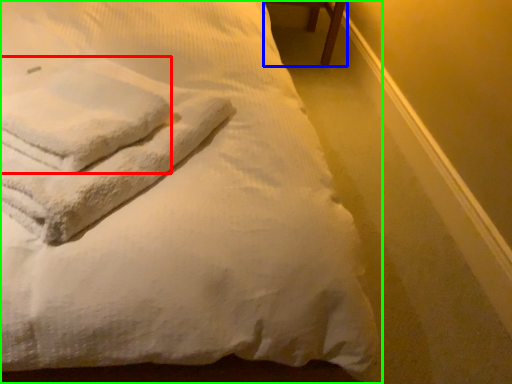
Question: Estimate the real-world distances between objects in this image. Which object is farther from bath towel (highlighted by a red box), furniture (highlighted by a blue box) or bed (highlighted by a green box)?

Choices:
 (A) furniture
 (B) bed

Answer: (A)